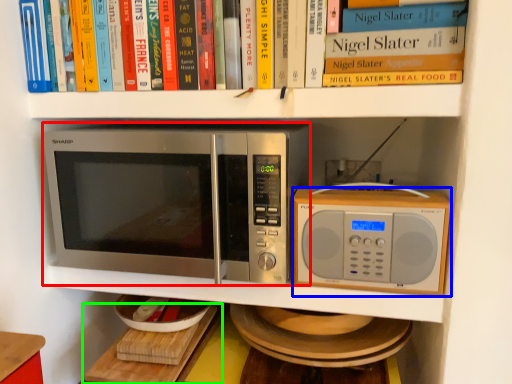
Question: Estimate the real-world distances between objects in this image. Which object is closer to microwave oven (highlighted by a red box), microwave oven (highlighted by a blue box) or table (highlighted by a green box)?

Choices:
 (A) microwave oven
 (B) table

Answer: (A)